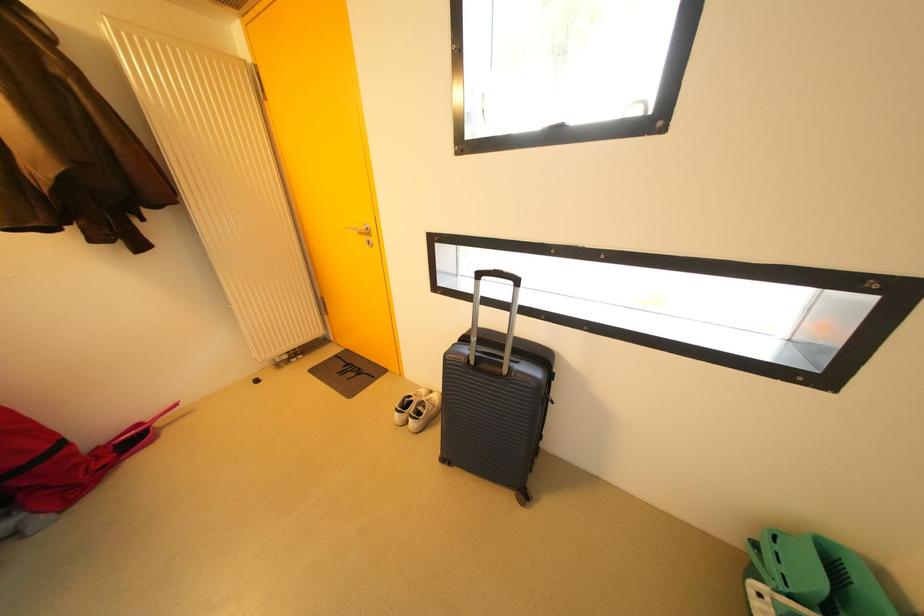
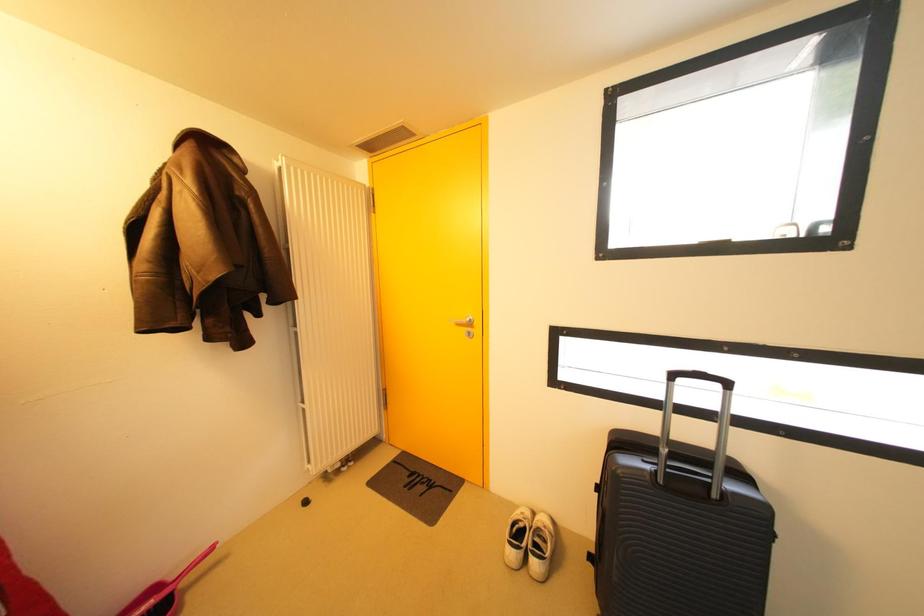
Question: What movement of the cameraman would produce the second image?

Choices:
 (A) Left
 (B) Right
 (C) Forward
 (D) Backward

Answer: (A)